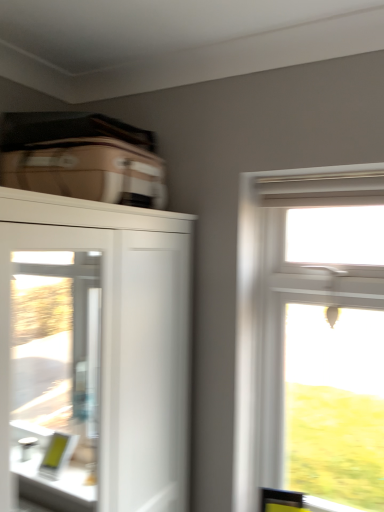
Question: Is clear glass window at upper right further to the viewer compared to clear glass screen door at left?

Choices:
 (A) no
 (B) yes

Answer: (B)

Question: From the image's perspective, is clear glass window at upper right located beneath clear glass screen door at left?

Choices:
 (A) no
 (B) yes

Answer: (B)

Question: Does clear glass window at upper right have a greater width compared to clear glass screen door at left?

Choices:
 (A) yes
 (B) no

Answer: (A)

Question: Is clear glass window at upper right not close to clear glass screen door at left?

Choices:
 (A) yes
 (B) no

Answer: (A)

Question: Does clear glass window at upper right have a lesser width compared to clear glass screen door at left?

Choices:
 (A) no
 (B) yes

Answer: (A)

Question: Is white glossy cupboard at upper left wider or thinner than beige fabric suitcase at upper left?

Choices:
 (A) thin
 (B) wide

Answer: (B)

Question: Considering the relative positions of white glossy cupboard at upper left and beige fabric suitcase at upper left in the image provided, is white glossy cupboard at upper left to the left or to the right of beige fabric suitcase at upper left?

Choices:
 (A) right
 (B) left

Answer: (B)

Question: Is white glossy cupboard at upper left inside the boundaries of beige fabric suitcase at upper left, or outside?

Choices:
 (A) outside
 (B) inside

Answer: (A)

Question: From the image's perspective, is white glossy cupboard at upper left located above or below beige fabric suitcase at upper left?

Choices:
 (A) below
 (B) above

Answer: (A)

Question: From the image's perspective, is beige fabric suitcase at upper left located above or below clear glass window at upper right?

Choices:
 (A) below
 (B) above

Answer: (B)

Question: From a real-world perspective, is beige fabric suitcase at upper left physically located above or below clear glass window at upper right?

Choices:
 (A) below
 (B) above

Answer: (B)

Question: Is beige fabric suitcase at upper left in front of or behind clear glass window at upper right in the image?

Choices:
 (A) front
 (B) behind

Answer: (A)

Question: Visually, is beige fabric suitcase at upper left positioned to the left or to the right of clear glass window at upper right?

Choices:
 (A) right
 (B) left

Answer: (B)

Question: Considering the relative positions of clear glass screen door at left and white glossy cupboard at upper left in the image provided, is clear glass screen door at left to the left or to the right of white glossy cupboard at upper left?

Choices:
 (A) right
 (B) left

Answer: (A)

Question: Considering the positions of clear glass screen door at left and white glossy cupboard at upper left in the image, is clear glass screen door at left bigger or smaller than white glossy cupboard at upper left?

Choices:
 (A) big
 (B) small

Answer: (B)